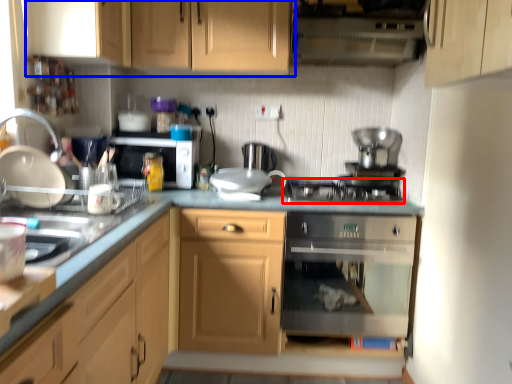
Question: Which object is further to the camera taking this photo, gas stove (highlighted by a red box) or cabinetry (highlighted by a blue box)?

Choices:
 (A) gas stove
 (B) cabinetry

Answer: (A)